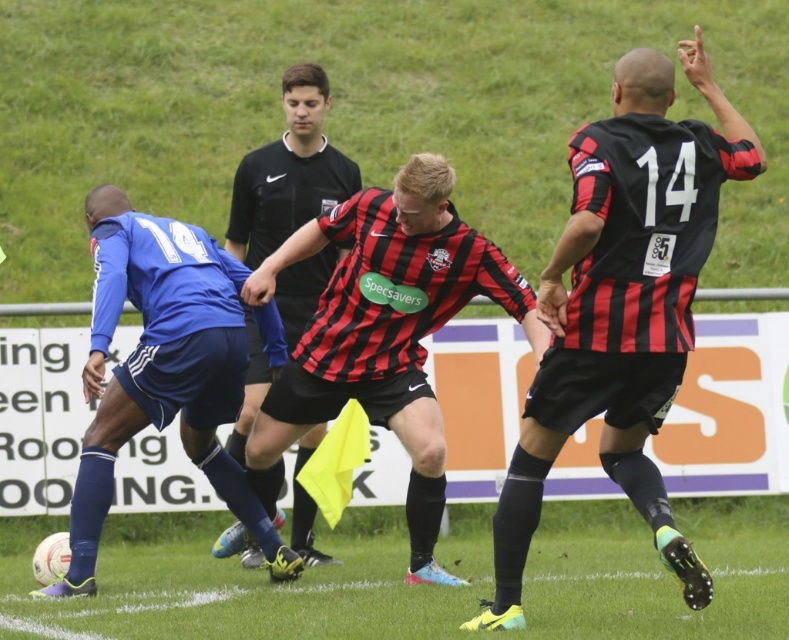
Question: Considering the real-world distances, which object is closest to the black jersey at center?

Choices:
 (A) green grass at lower center
 (B) blue fabric jersey at left
 (C) red and black striped jersey at center

Answer: (B)

Question: Based on their relative distances, which object is farther from the blue fabric jersey at left?

Choices:
 (A) green grass at lower center
 (B) black and red striped jersey at upper right
 (C) black jersey at center
 (D) red and black striped jersey at center

Answer: (B)

Question: Can you confirm if green grass at lower center is positioned to the left of black and red striped jersey at upper right?

Choices:
 (A) no
 (B) yes

Answer: (B)

Question: Based on their relative distances, which object is farther from the black jersey at center?

Choices:
 (A) red and black striped jersey at center
 (B) blue fabric jersey at left
 (C) black and red striped jersey at upper right
 (D) green grass at lower center

Answer: (C)

Question: Is black and red striped jersey at upper right above blue fabric jersey at left?

Choices:
 (A) yes
 (B) no

Answer: (A)

Question: Does green grass at lower center come behind red and black striped jersey at center?

Choices:
 (A) no
 (B) yes

Answer: (B)